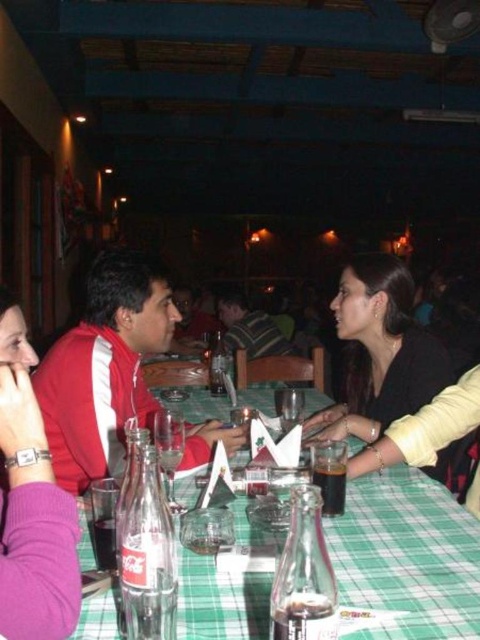
Looking at this image, you are a waiter in the restaurant and need to deliver a drink to the customer wearing the purple fabric shirt at left. Which direction should you approach from to avoid blocking the view of the black matte jacket at center?

The purple fabric shirt at left is located below the black matte jacket at center, so approaching from the lower side would allow you to reach the purple fabric shirt at left without obstructing the view of the black matte jacket at center.

You are a server in this restaurant and need to determine which item is smaller between the black matte jacket at center and the striped fabric shirt at center. Which one is smaller?

The black matte jacket at center is smaller than the striped fabric shirt at center.

You are a waiter in the restaurant and need to deliver a drink to the person wearing the purple fabric shirt at left. Based on their position, where should you approach from?

The purple fabric shirt at left is located at point (32, 508), so you should approach from the left side to reach them effectively.